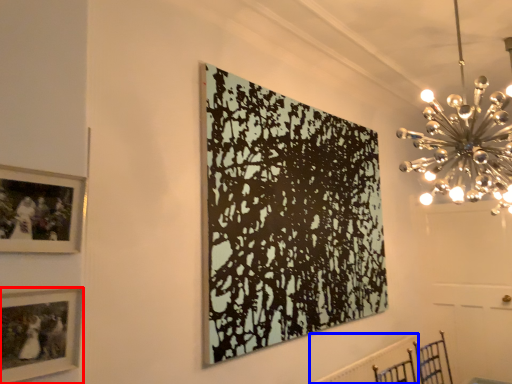
Question: Among these objects, which one is nearest to the camera, picture frame (highlighted by a red box) or radiator (highlighted by a blue box)?

Choices:
 (A) picture frame
 (B) radiator

Answer: (A)